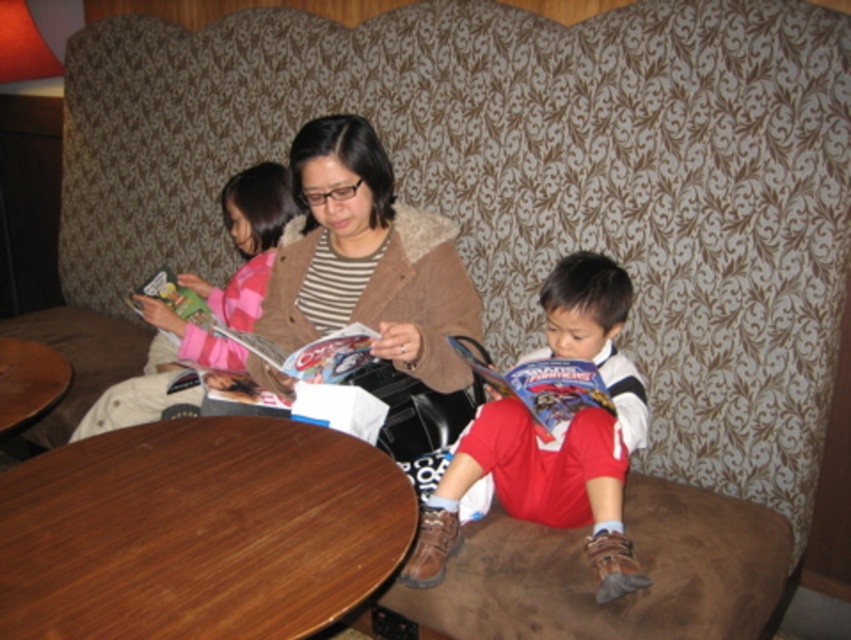
Does brown fuzzy jacket at center have a lesser height compared to matte plastic magazine at lower right?

No.

Can you confirm if brown fuzzy jacket at center is smaller than matte plastic magazine at lower right?

No, brown fuzzy jacket at center is not smaller than matte plastic magazine at lower right.

Image resolution: width=851 pixels, height=640 pixels. Describe the element at coordinates (370, 273) in the screenshot. I see `brown fuzzy jacket at center` at that location.

This screenshot has height=640, width=851. Identify the location of brown fuzzy jacket at center. (370, 273).

Is pink striped sweater at upper left shorter than matte plastic magazine at lower right?

In fact, pink striped sweater at upper left may be taller than matte plastic magazine at lower right.

Between pink striped sweater at upper left and matte plastic magazine at lower right, which one appears on the right side from the viewer's perspective?

From the viewer's perspective, matte plastic magazine at lower right appears more on the right side.

Which is in front, point (256, 272) or point (581, 385)?

Point (581, 385) is more forward.

Locate an element on the screen. pink striped sweater at upper left is located at coordinates (248, 241).

Between matte plastic magazine at center and matte green magazine at upper left, which one appears on the left side from the viewer's perspective?

Positioned to the left is matte green magazine at upper left.

Describe the element at coordinates (312, 353) in the screenshot. I see `matte plastic magazine at center` at that location.

The height and width of the screenshot is (640, 851). Find the location of `matte plastic magazine at center`. matte plastic magazine at center is located at coordinates (312, 353).